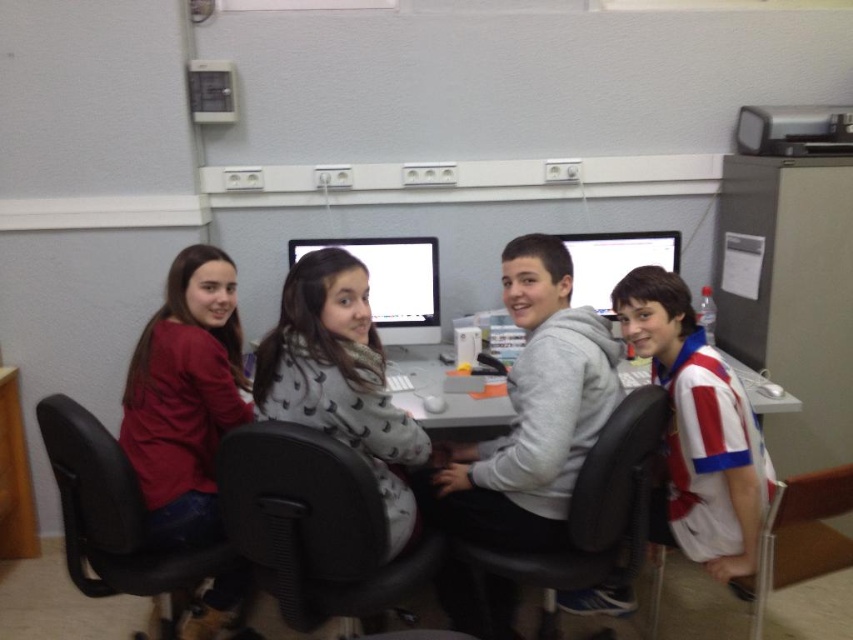
Is black plastic chair at lower right to the right of matte white monitor at center from the viewer's perspective?

Yes, black plastic chair at lower right is to the right of matte white monitor at center.

Between point (747, 595) and point (602, 314), which one is positioned in front?

Positioned in front is point (747, 595).

I want to click on black plastic chair at lower right, so click(799, 536).

Between point (366, 266) and point (624, 380), which one is positioned in front?

Point (366, 266) is in front.

Who is positioned more to the right, matte plastic monitor at center or white plastic table at center?

white plastic table at center is more to the right.

Where is `matte plastic monitor at center`? matte plastic monitor at center is located at coordinates (392, 282).

Consider the image. Does gray matte hoodie at center have a larger size compared to white plastic table at center?

Indeed, gray matte hoodie at center has a larger size compared to white plastic table at center.

Who is more forward, (469, 496) or (440, 417)?

Point (469, 496) is more forward.

You are a GUI agent. You are given a task and a screenshot of the screen. Output one action in this format:
    pyautogui.click(x=<x>, y=<y>)
    Task: Click on the gray matte hoodie at center
    This screenshot has width=853, height=640.
    Given the screenshot: What is the action you would take?
    [x=535, y=410]